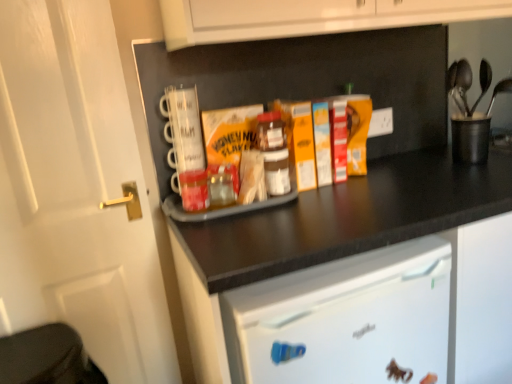
Question: Is there a large distance between translucent plastic jar at center and black plastic utensil holder at upper right?

Choices:
 (A) no
 (B) yes

Answer: (A)

Question: Is translucent plastic jar at center to the right of black plastic utensil holder at upper right from the viewer's perspective?

Choices:
 (A) no
 (B) yes

Answer: (A)

Question: Can you confirm if translucent plastic jar at center is taller than black plastic utensil holder at upper right?

Choices:
 (A) yes
 (B) no

Answer: (B)

Question: Considering the relative positions of translucent plastic jar at center and black plastic utensil holder at upper right in the image provided, is translucent plastic jar at center to the left of black plastic utensil holder at upper right from the viewer's perspective?

Choices:
 (A) no
 (B) yes

Answer: (B)

Question: Is translucent plastic jar at center bigger than black plastic utensil holder at upper right?

Choices:
 (A) no
 (B) yes

Answer: (A)

Question: In terms of width, does black plastic utensil holder at upper right look wider or thinner when compared to white matte door at left?

Choices:
 (A) wide
 (B) thin

Answer: (A)

Question: From their relative heights in the image, would you say black plastic utensil holder at upper right is taller or shorter than white matte door at left?

Choices:
 (A) tall
 (B) short

Answer: (B)

Question: In the image, is black plastic utensil holder at upper right on the left side or the right side of white matte door at left?

Choices:
 (A) left
 (B) right

Answer: (B)

Question: Is black plastic utensil holder at upper right in front of or behind white matte door at left in the image?

Choices:
 (A) front
 (B) behind

Answer: (B)

Question: Looking at the image, does white matte door at left seem bigger or smaller compared to black plastic utensil holder at upper right?

Choices:
 (A) big
 (B) small

Answer: (A)

Question: Is white matte door at left wider or thinner than black plastic utensil holder at upper right?

Choices:
 (A) thin
 (B) wide

Answer: (A)

Question: Is white matte door at left spatially inside black plastic utensil holder at upper right, or outside of it?

Choices:
 (A) inside
 (B) outside

Answer: (B)

Question: Based on their positions, is white matte door at left located to the left or right of black plastic utensil holder at upper right?

Choices:
 (A) right
 (B) left

Answer: (B)

Question: Is point (8, 139) closer or farther from the camera than point (267, 150)?

Choices:
 (A) closer
 (B) farther

Answer: (A)

Question: In the image, is white matte door at left positioned in front of or behind translucent plastic jar at center?

Choices:
 (A) behind
 (B) front

Answer: (B)